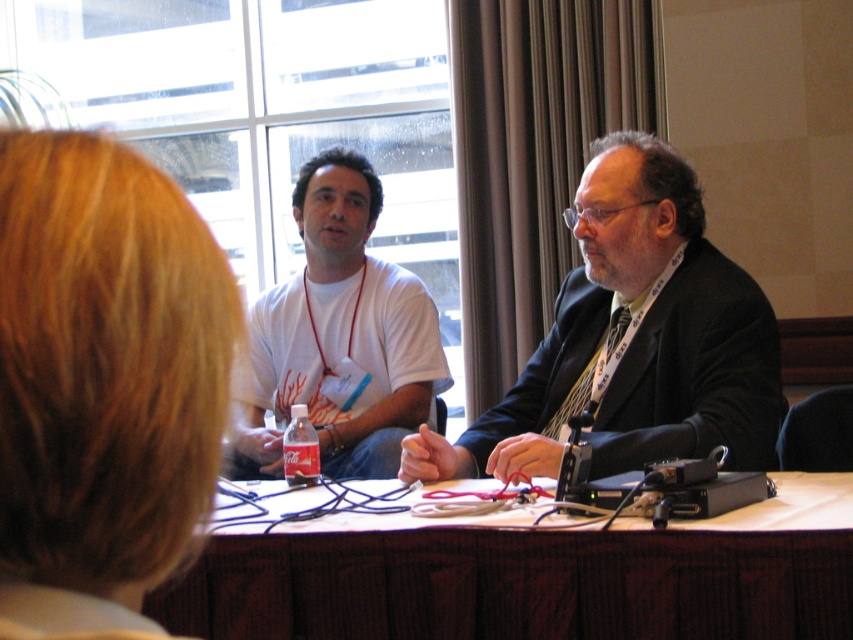
Can you confirm if blonde hair at upper left is bigger than dark suit at center?

No.

Which is behind, point (126, 332) or point (457, 477)?

The point (457, 477) is behind.

Find the location of a particular element. This screenshot has width=853, height=640. blonde hair at upper left is located at coordinates (105, 365).

Can you confirm if dark suit at center is positioned below white t-shirt at center?

Yes.

Describe the element at coordinates (633, 339) in the screenshot. I see `dark suit at center` at that location.

Does point (622, 412) come farther from viewer compared to point (366, 182)?

No, it is not.

Locate an element on the screen. dark suit at center is located at coordinates (633, 339).

Is point (123, 413) farther from viewer compared to point (422, 305)?

No, it is in front of (422, 305).

Consider the image. Which of these two, blonde hair at upper left or white t-shirt at center, stands taller?

white t-shirt at center is taller.

Is point (206, 317) positioned behind point (334, 364)?

That is False.

What are the coordinates of `blonde hair at upper left` in the screenshot? It's located at coord(105,365).